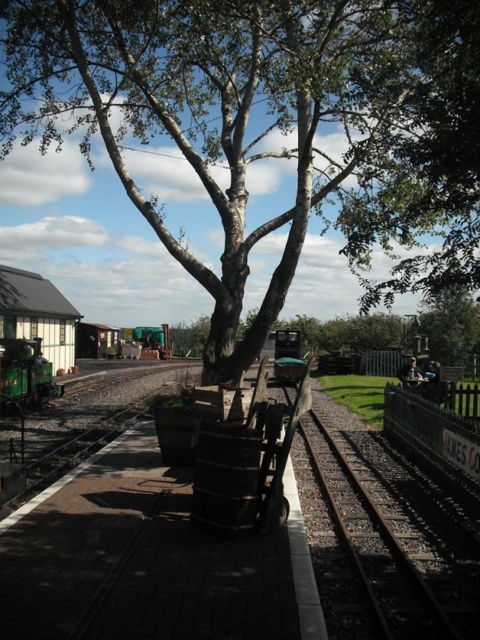
Is dark brown metal train track at center thinner than green matte train at left?

No, dark brown metal train track at center is not thinner than green matte train at left.

Is point (412, 605) farther from camera compared to point (0, 380)?

That is False.

Which is in front, point (340, 604) or point (45, 384)?

Point (340, 604)

Find the location of `dark brown metal train track at center`. dark brown metal train track at center is located at coordinates (383, 540).

Does green leafy tree at center have a greater width compared to dark brown metal train track at center?

Yes, green leafy tree at center is wider than dark brown metal train track at center.

Measure the distance from green leafy tree at center to dark brown metal train track at center.

They are 90.25 feet apart.

Which is in front, point (351, 16) or point (365, 580)?

Positioned in front is point (365, 580).

Where is `green leafy tree at center`? The height and width of the screenshot is (640, 480). green leafy tree at center is located at coordinates (266, 134).

Is green leafy tree at center positioned before green matte train at left?

Yes, green leafy tree at center is in front of green matte train at left.

Describe the element at coordinates (266, 134) in the screenshot. The height and width of the screenshot is (640, 480). I see `green leafy tree at center` at that location.

Locate an element on the screen. green leafy tree at center is located at coordinates (266, 134).